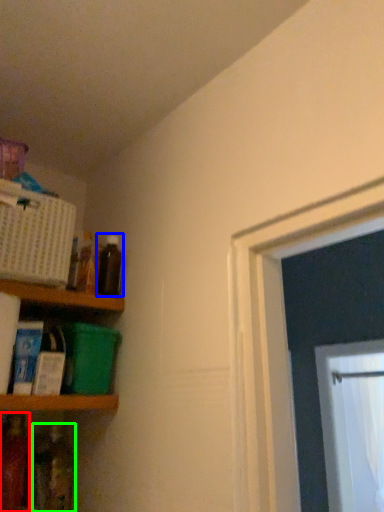
Question: Which is farther away from bottle (highlighted by a red box)? bottle (highlighted by a blue box) or bottle (highlighted by a green box)?

Choices:
 (A) bottle
 (B) bottle

Answer: (A)